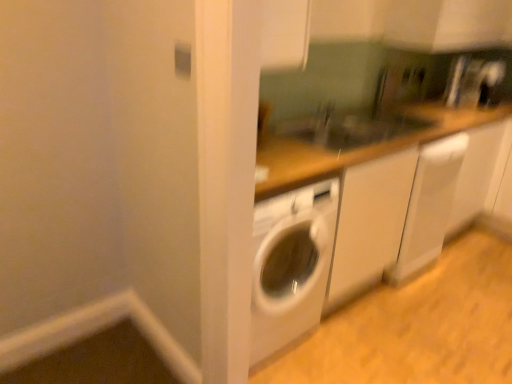
The width and height of the screenshot is (512, 384). What do you see at coordinates (349, 127) in the screenshot? I see `matte brown sink at center` at bounding box center [349, 127].

Identify the location of matte brown sink at center. (349, 127).

Find the location of a particular element. The width and height of the screenshot is (512, 384). matte brown sink at center is located at coordinates (349, 127).